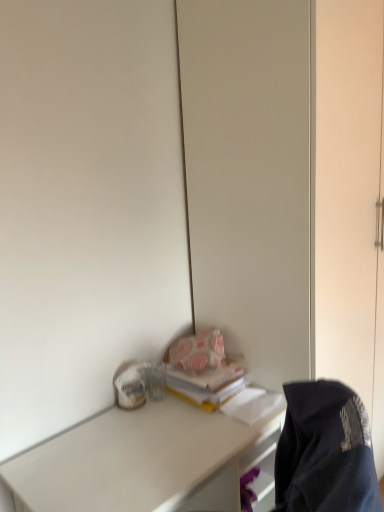
Locate an element on the screen. The width and height of the screenshot is (384, 512). vacant space in front of yellow matte book at center is located at coordinates (184, 429).